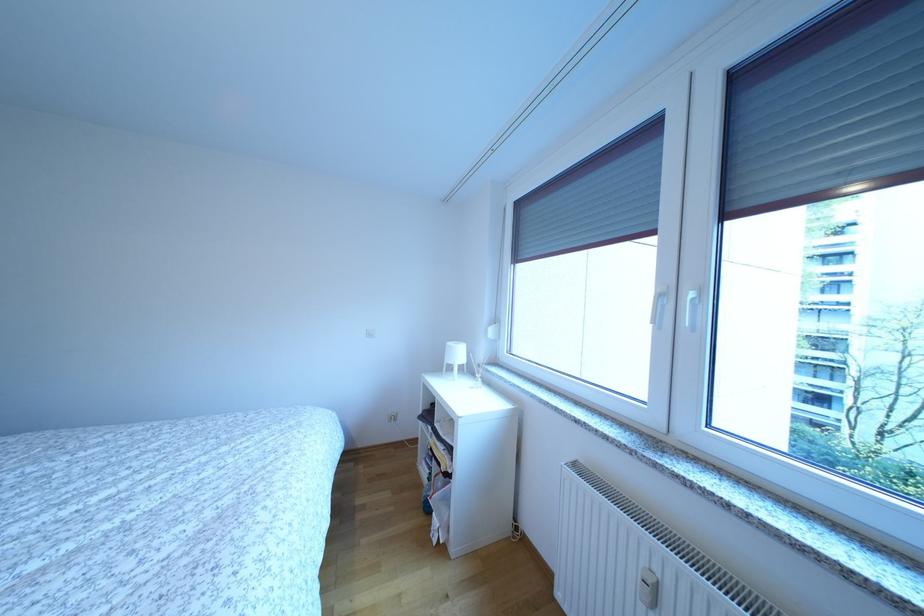
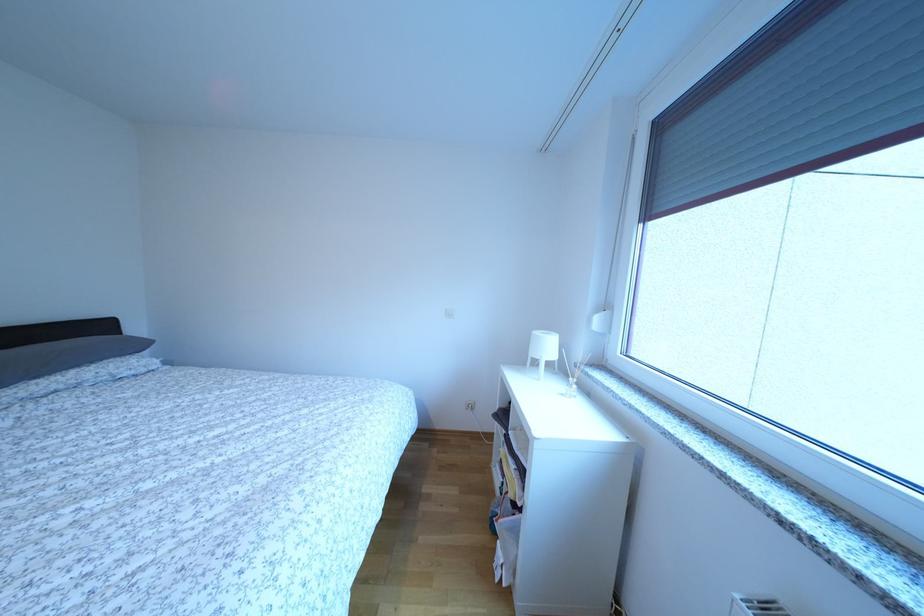
Question: What movement of the cameraman would produce the second image?

Choices:
 (A) Left
 (B) Right
 (C) Forward
 (D) Backward

Answer: (C)